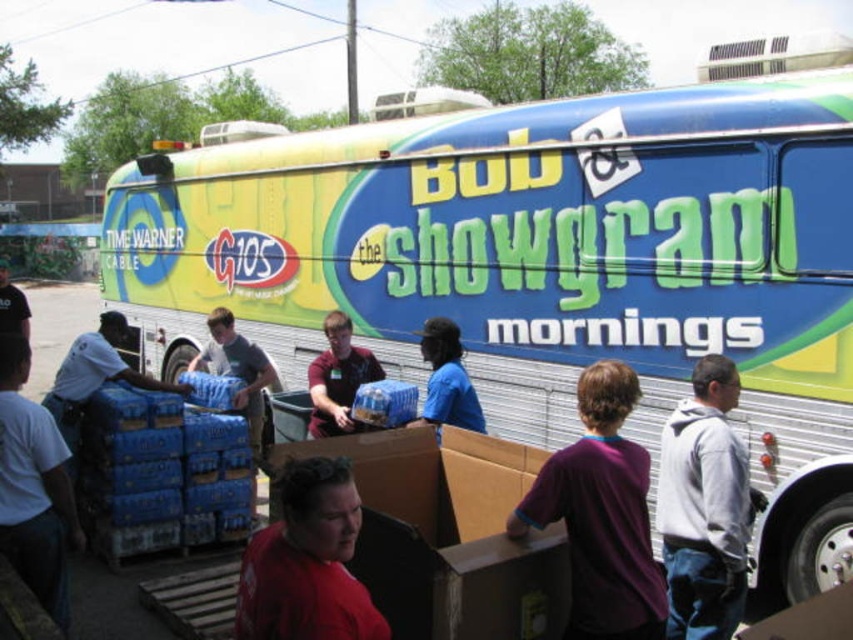
Does matte red shirt at center have a larger size compared to dark blue t-shirt at center?

Incorrect, matte red shirt at center is not larger than dark blue t-shirt at center.

Based on the photo, does matte red shirt at center appear on the left side of dark blue t-shirt at center?

No, matte red shirt at center is not to the left of dark blue t-shirt at center.

Which is behind, point (273, 531) or point (1, 298)?

The point (1, 298) is more distant.

The height and width of the screenshot is (640, 853). I want to click on matte red shirt at center, so click(x=306, y=561).

Which is more to the right, brown cardboard box at center or purple cotton shirt at center?

purple cotton shirt at center

In order to click on brown cardboard box at center in this screenshot , I will do `click(450, 532)`.

The width and height of the screenshot is (853, 640). I want to click on brown cardboard box at center, so click(x=450, y=532).

Who is more forward, (479, 612) or (444, 420)?

Point (479, 612)

Does brown cardboard box at center appear on the left side of blue shirt at center?

Indeed, brown cardboard box at center is positioned on the left side of blue shirt at center.

Does point (485, 490) lie behind point (469, 420)?

No.

At what (x,y) coordinates should I click in order to perform the action: click on brown cardboard box at center. Please return your answer as a coordinate pair (x, y). The height and width of the screenshot is (640, 853). Looking at the image, I should click on (450, 532).